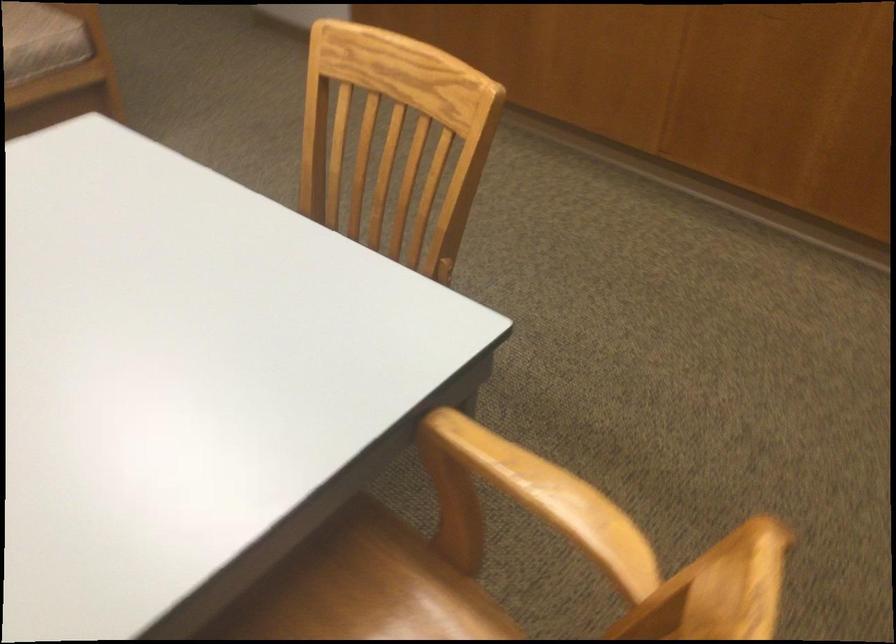
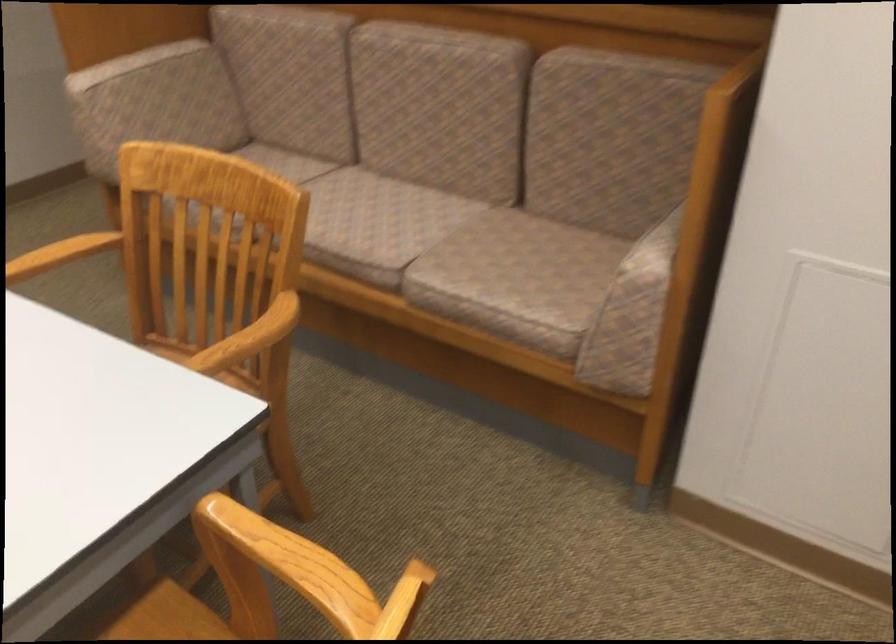
In the second image, find the point that corresponds to [579,498] in the first image.

(62, 252)